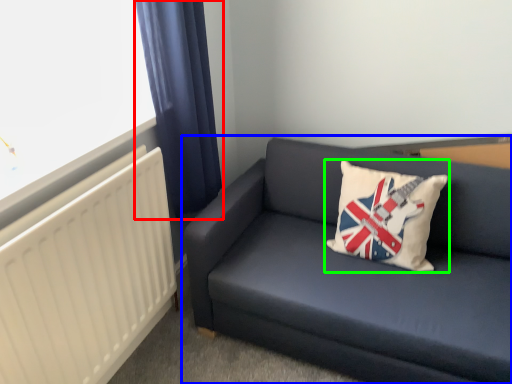
Question: Which object is positioned closest to curtain (highlighted by a red box)? Select from studio couch (highlighted by a blue box) and pillow (highlighted by a green box).

Choices:
 (A) studio couch
 (B) pillow

Answer: (A)